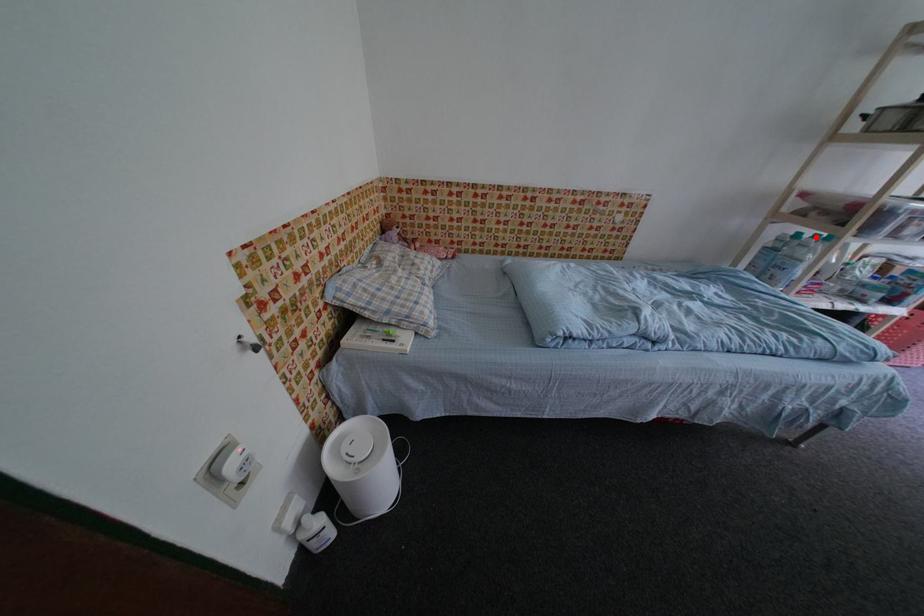
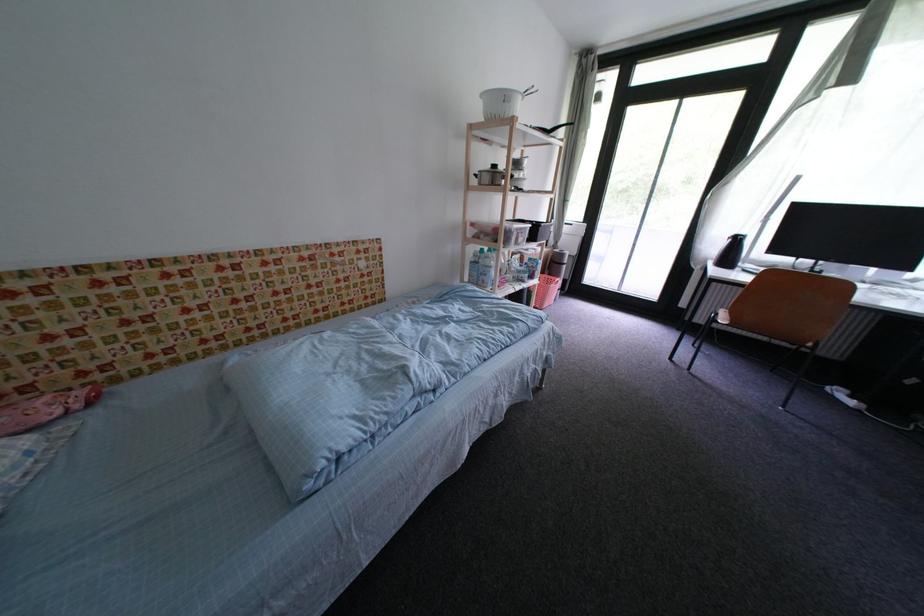
The point at the highlighted location is marked in the first image. Where is the corresponding point in the second image?

(493, 252)